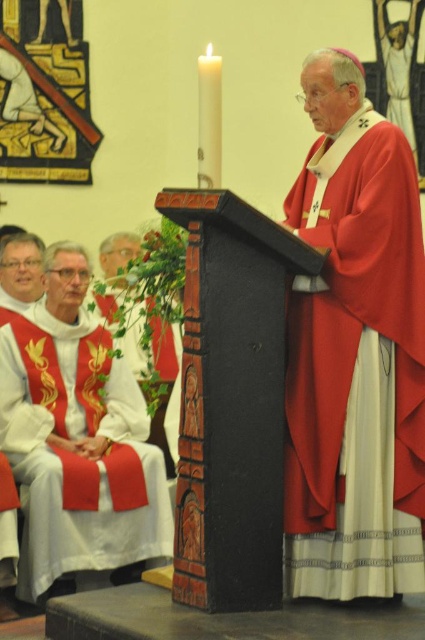
Question: Is matte red fabric at center closer to camera compared to matte red vestment at left?

Choices:
 (A) yes
 (B) no

Answer: (A)

Question: Which object is closer to the camera taking this photo?

Choices:
 (A) matte red fabric at center
 (B) matte red vestment at left

Answer: (A)

Question: Which object appears closest to the camera in this image?

Choices:
 (A) matte red fabric at center
 (B) matte red vestment at left

Answer: (A)

Question: Can you confirm if matte red fabric at center is positioned to the right of matte red vestment at left?

Choices:
 (A) no
 (B) yes

Answer: (B)

Question: Is matte red fabric at center thinner than matte red vestment at left?

Choices:
 (A) yes
 (B) no

Answer: (A)